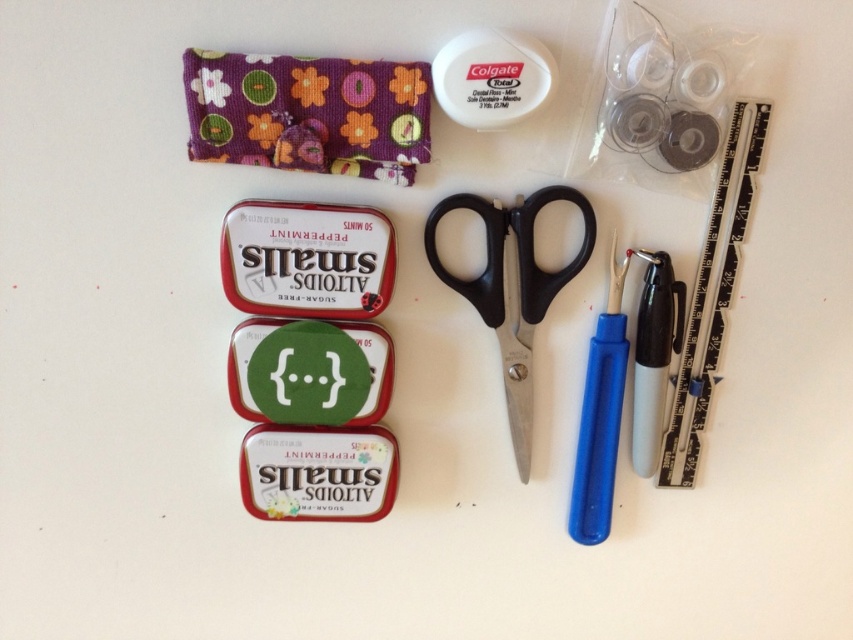
You are organizing a craft kit and need to place the black plastic ruler at upper right and the blue plastic needle at right into a vertical storage compartment. The compartment is only 10 cm tall. Can both items fit vertically without overlapping?

The black plastic ruler at upper right is much taller than the blue plastic needle at right. Since the compartment is only 10 cm tall, if the ruler exceeds this height, it won

Consider the image. You are organizing a craft kit and need to place the black plastic scissors at center and the blue plastic needle at right into a drawer. The drawer has a divider that separates the top and bottom sections. Can the scissors and needle be placed in different sections without moving them from their current positions?

The black plastic scissors at center is located above the blue plastic needle at right, so if the drawer divider separates the top and bottom sections vertically, the scissors would be in the top section and the needle in the bottom section. They can be placed in different sections without moving them.

You are standing 5 feet away from the white surface where the tools are placed. You want to reach the point marked at coordinates [669,422]. Can you comfortably extend your hand to that point without moving closer?

The distance of point [669,422] from viewer is 4.26 feet, so since you are standing 5 feet away, you are 0.74 feet farther than the point. You can comfortably extend your hand to reach it without moving closer.